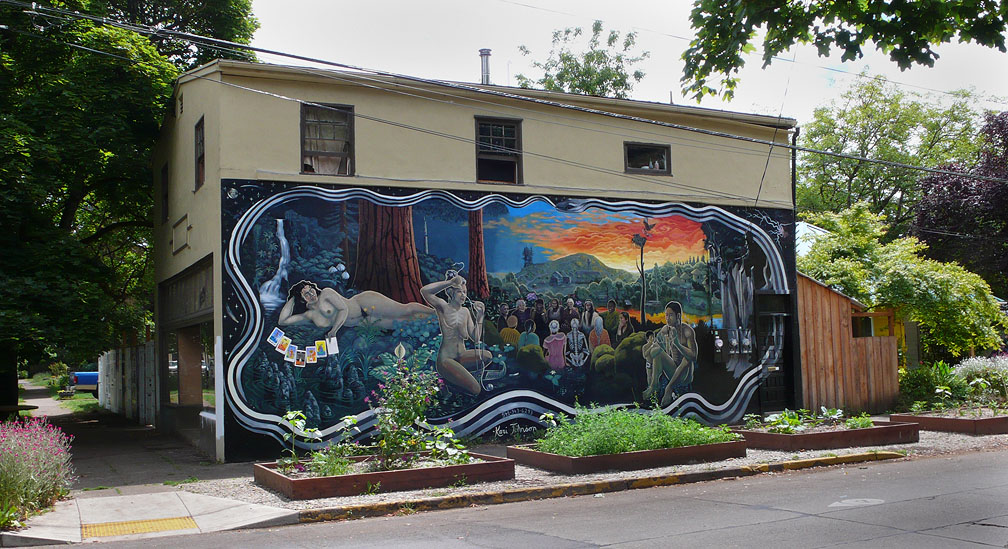
Find the location of a particular element. mural is located at coordinates (477, 247).